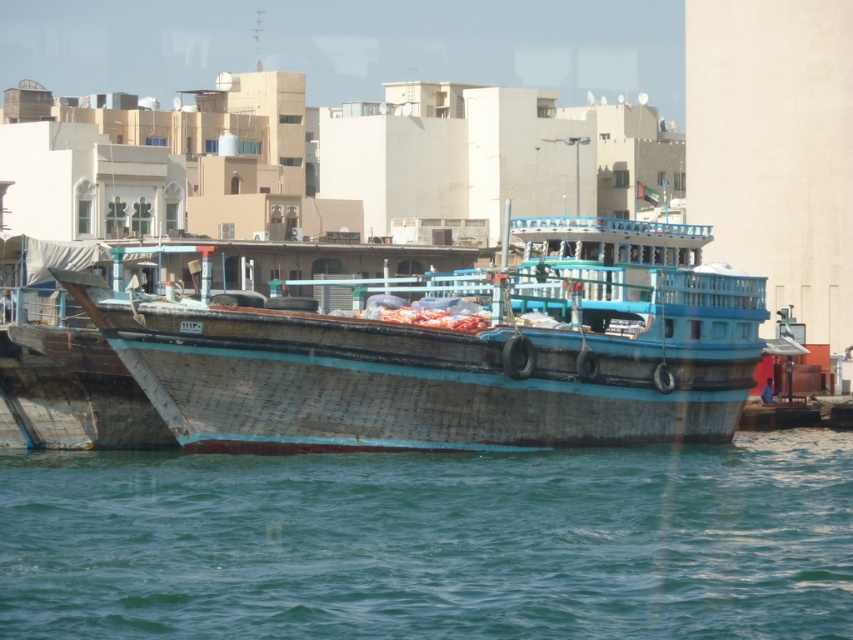
You are standing on the deck of the dhow boat and want to jump into the water. Where should you jump to land in the teal matte water at lower center?

You should jump towards the lower center of the image, where the teal matte water at lower center is located at point coordinates of (432, 541).

You are standing on the deck of the dhow boat and see the point marked at coordinates (432, 541). What object is located at that point?

The point at coordinates (432, 541) indicates the teal matte water at lower center.

You are standing on the dock and see the teal matte water at lower center and the wooden boat at center. Which object is positioned to the left of the other?

The teal matte water at lower center is to the left of wooden boat at center.